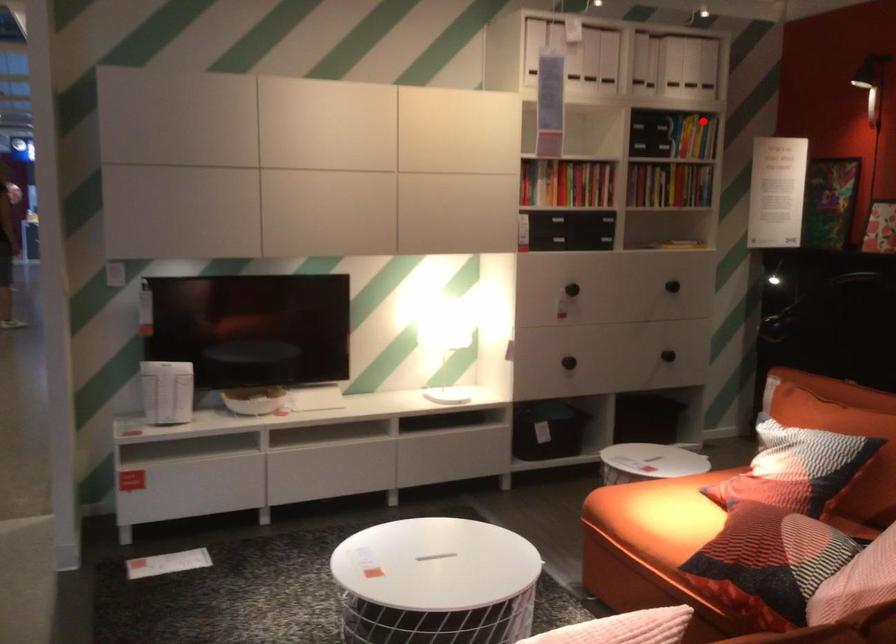
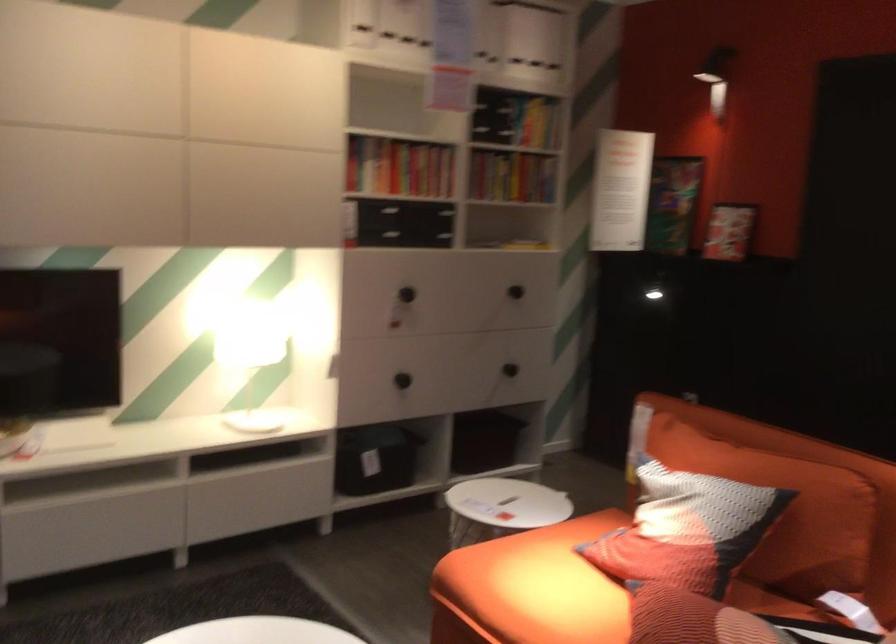
Find the pixel in the second image that matches the highlighted location in the first image.

(538, 124)